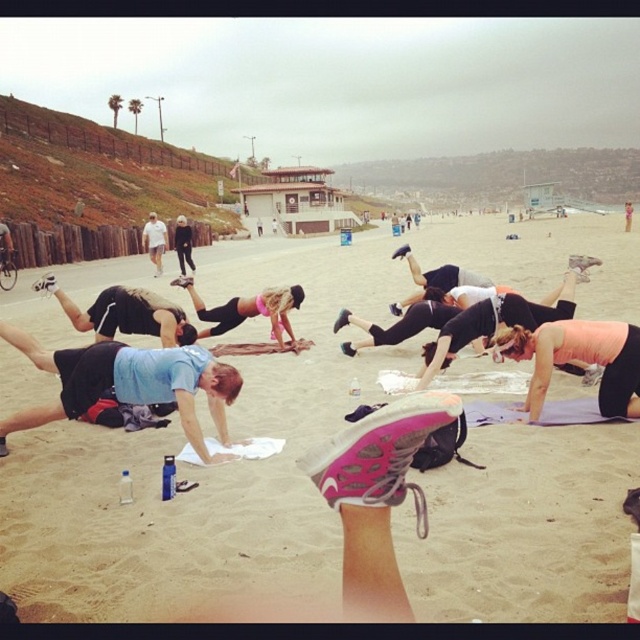
Question: Which point appears closest to the camera in this image?

Choices:
 (A) (300, 300)
 (B) (115, 380)
 (C) (465, 588)
 (D) (166, 330)

Answer: (C)

Question: Which point is closer to the camera?

Choices:
 (A) pink matte yoga mat at lower right
 (B) blue fabric shirt at center
 (C) matte black leggings at center

Answer: (B)

Question: Is blue fabric shirt at center to the left of blue fabric yoga mat at center from the viewer's perspective?

Choices:
 (A) no
 (B) yes

Answer: (A)

Question: Can you confirm if blue fabric shirt at center is smaller than blue fabric yoga mat at center?

Choices:
 (A) no
 (B) yes

Answer: (A)

Question: Is beige sand at center below blue fabric shirt at center?

Choices:
 (A) yes
 (B) no

Answer: (B)

Question: Which point is farther to the camera?

Choices:
 (A) blue fabric yoga mat at center
 (B) blue fabric shirt at center
 (C) matte black leggings at center

Answer: (C)